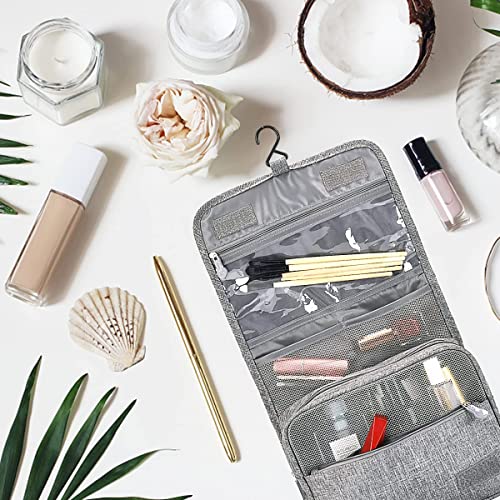
Locate an element on the screen. glass is located at coordinates (478, 104), (494, 268), (220, 59), (79, 86).